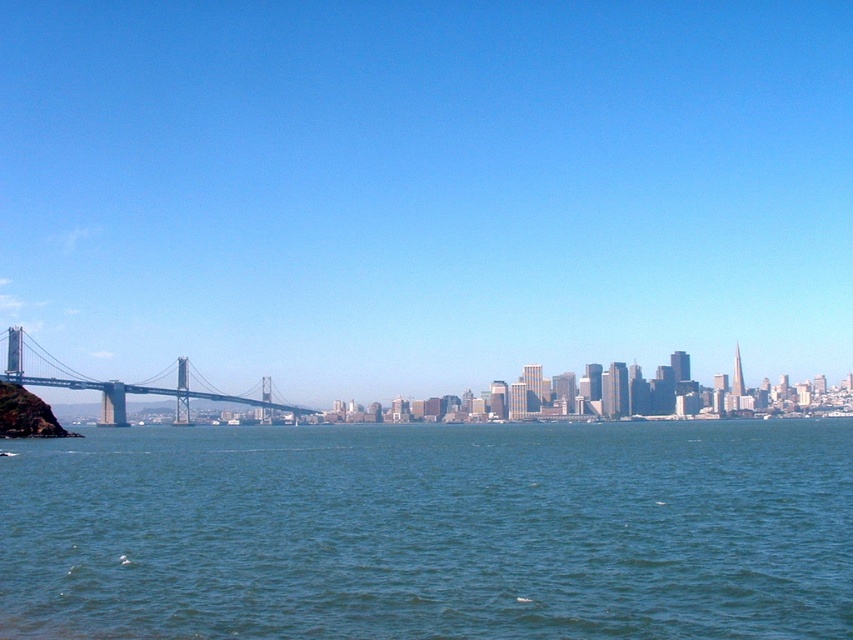
Question: From the image, what is the correct spatial relationship of green water at lower center in relation to metallic gray bridge at left?

Choices:
 (A) left
 (B) right

Answer: (B)

Question: Among these points, which one is nearest to the camera?

Choices:
 (A) (675, 634)
 (B) (390, 336)
 (C) (112, 380)

Answer: (A)

Question: Among these points, which one is nearest to the camera?

Choices:
 (A) (268, 406)
 (B) (843, 364)
 (C) (138, 476)

Answer: (C)

Question: Can you confirm if transparent glass bridge at center is positioned below metallic gray bridge at left?

Choices:
 (A) no
 (B) yes

Answer: (A)

Question: Does transparent glass bridge at center appear on the left side of metallic gray bridge at left?

Choices:
 (A) yes
 (B) no

Answer: (B)

Question: Which is farther from the transparent glass bridge at center?

Choices:
 (A) green water at lower center
 (B) metallic gray bridge at left

Answer: (A)